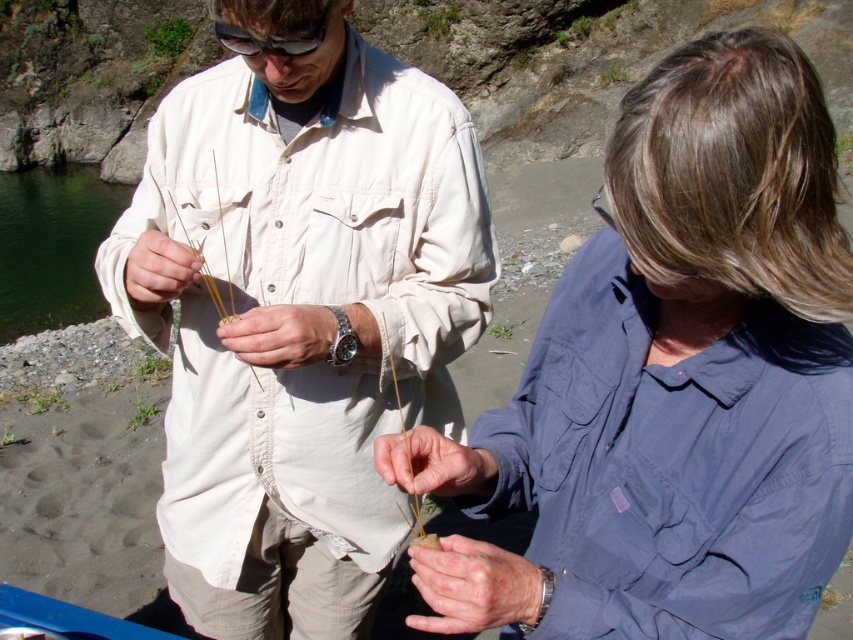
You are standing in the scene and want to pick up the smooth tan stick at center and the matte beige stick at center. Which stick should you reach for first if you want to grab the one that is nearer to you?

You should reach for the smooth tan stick at center first because it is closer to you than the matte beige stick at center.

You are a hiker who just found two items in the middle of a rocky path near the water. You need to determine which item is closer to the ground. The items are dry skin at center and smooth tan stick at center. Which one is lower?

The dry skin at center is below smooth tan stick at center, so the dry skin at center is lower.

Looking at this image, you are an archaeologist examining two sticks found at a prehistoric site. You have the smooth tan stick at center and the matte beige stick at center in front of you. Which stick is located to the right when viewed from your perspective?

The smooth tan stick at center is positioned on the right side of the matte beige stick at center, so when viewed from your perspective, the smooth tan stick at center is to the right.